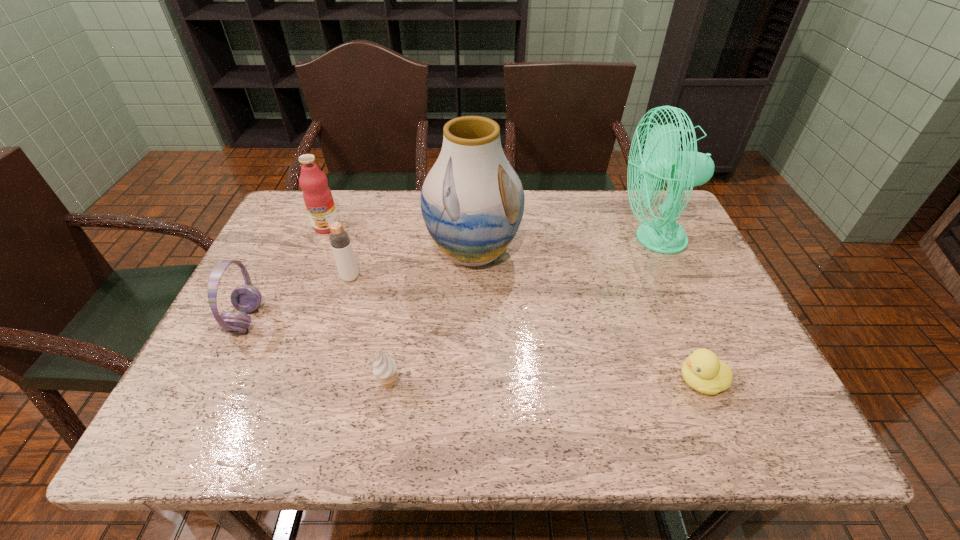
Identify the location of vacant area that lies between the duckling and the fan. 678,310.

The height and width of the screenshot is (540, 960). In order to click on free spot between the leftmost object and the fan in this screenshot , I will do `click(450, 279)`.

The image size is (960, 540). What are the coordinates of `free space between the icecream and the bottle` in the screenshot? It's located at (370, 331).

Locate an element on the screen. The height and width of the screenshot is (540, 960). vacant space in between the fourth object from right to left and the fifth object from right to left is located at coordinates (370, 331).

What are the coordinates of `empty space between the shortest object and the fifth object from right to left` in the screenshot? It's located at (525, 329).

Locate an element on the screen. Image resolution: width=960 pixels, height=540 pixels. empty space between the fifth farthest object and the fourth object from right to left is located at coordinates (318, 352).

I want to click on the second closest object to the sixth object from right to left, so click(x=246, y=298).

Identify which object is located as the nearest to the fifth object from right to left. Please provide its 2D coordinates. Your answer should be formatted as a tuple, i.e. [(x, y)], where the tuple contains the x and y coordinates of a point satisfying the conditions above.

[(317, 196)]

The height and width of the screenshot is (540, 960). Find the location of `free space that satisfies the following two spatial constraints: 1. in front of the fan to blow air; 2. on the front-facing side of the fourth object from right to left`. free space that satisfies the following two spatial constraints: 1. in front of the fan to blow air; 2. on the front-facing side of the fourth object from right to left is located at coordinates coord(719,384).

At what (x,y) coordinates should I click in order to perform the action: click on blank space that satisfies the following two spatial constraints: 1. on the label of the second object from left to right; 2. on the headband and ear cups of the leftmost object. Please return your answer as a coordinate pair (x, y). This screenshot has height=540, width=960. Looking at the image, I should click on (289, 319).